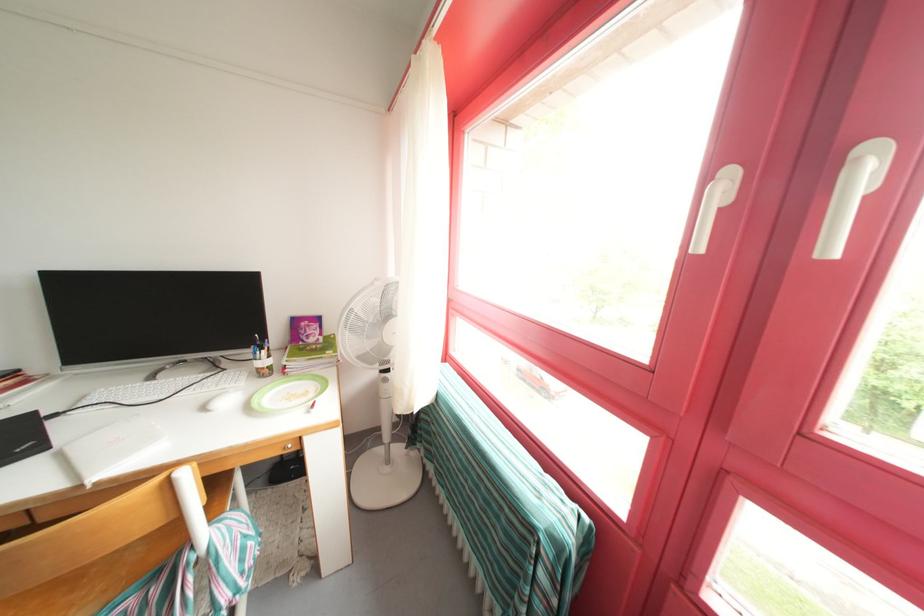
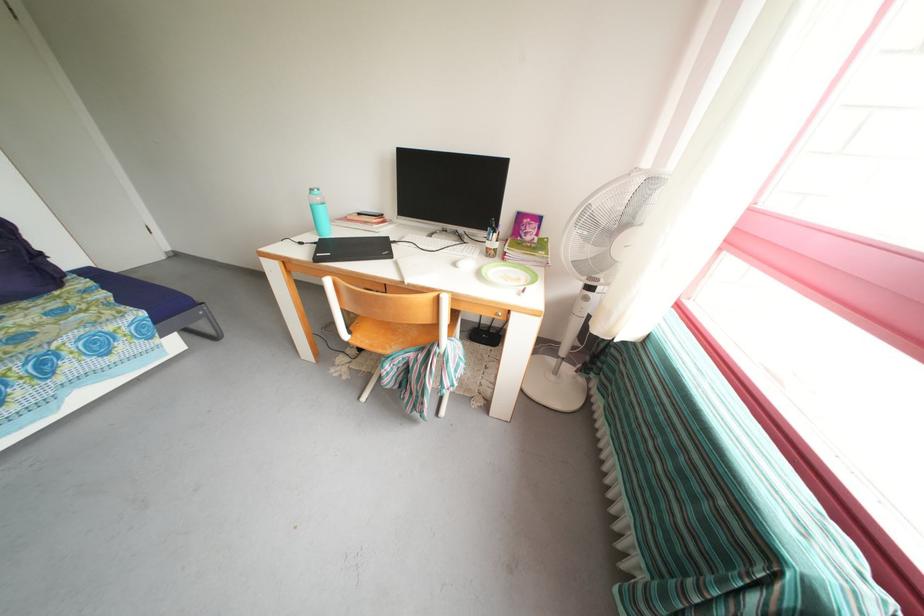
The point at [211,413] is marked in the first image. Where is the corresponding point in the second image?

(462, 269)